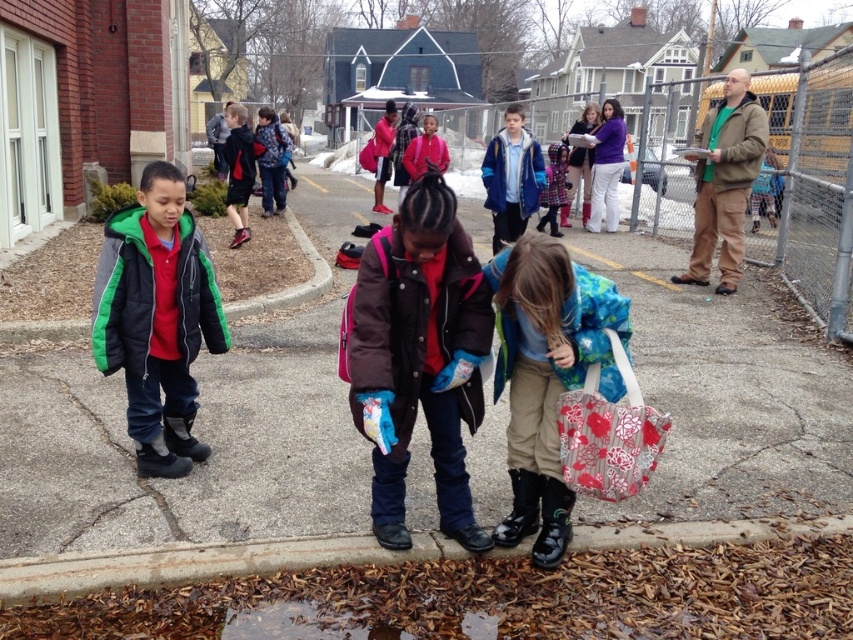
Is brown concrete curb at lower center taller than wet asphalt puddle at lower center?

Indeed, brown concrete curb at lower center has a greater height compared to wet asphalt puddle at lower center.

Between brown concrete curb at lower center and wet asphalt puddle at lower center, which one has less height?

wet asphalt puddle at lower center is shorter.

Between point (15, 557) and point (389, 637), which one is positioned behind?

The point (15, 557) is behind.

Locate an element on the screen. brown concrete curb at lower center is located at coordinates (200, 563).

Does paved asphalt at center have a lesser width compared to floral fabric bag at lower center?

Incorrect, paved asphalt at center's width is not less than floral fabric bag at lower center's.

Does paved asphalt at center have a greater height compared to floral fabric bag at lower center?

Yes, paved asphalt at center is taller than floral fabric bag at lower center.

Between point (86, 508) and point (523, 532), which one is positioned behind?

Point (86, 508)

The width and height of the screenshot is (853, 640). I want to click on paved asphalt at center, so click(194, 468).

Between green quilted jacket at left and floral fabric bag at lower center, which one is positioned lower?

floral fabric bag at lower center is lower down.

Is green quilted jacket at left taller than floral fabric bag at lower center?

Yes.

Between point (169, 186) and point (552, 268), which one is positioned in front?

Point (552, 268) is more forward.

Find the location of `green quilted jacket at left`. green quilted jacket at left is located at coordinates (155, 317).